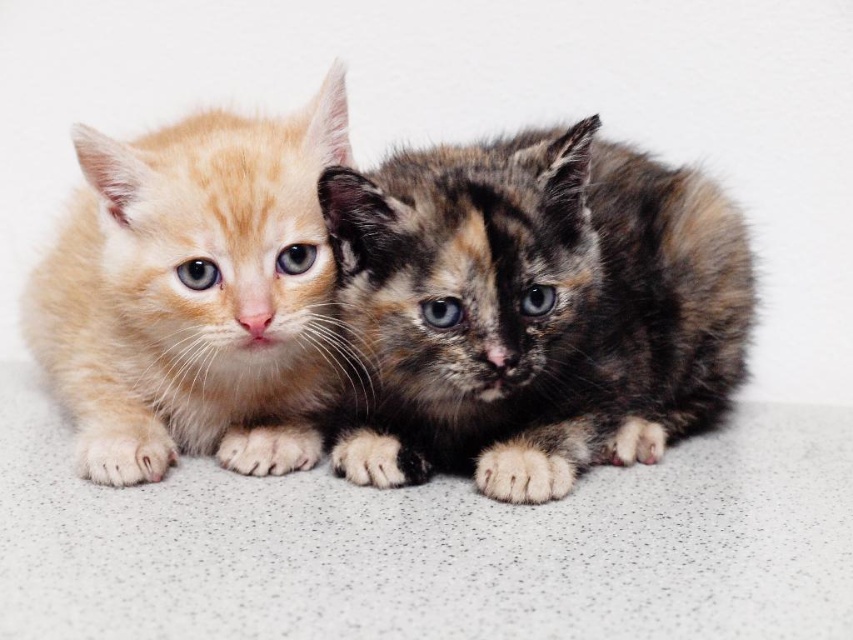
You are a photographer trying to capture both kittens in a single shot. Since the background is white, you want to ensure that the calico fur kitten at center and the matte orange kitten at left are both clearly visible. Based on their positions, which kitten might be easier to see against the white background?

The calico fur kitten at center is in front of the matte orange kitten at left, so the calico fur kitten at center will be easier to see against the white background because it is closer to the camera and not obscured by the other kitten.

You are a cat owner who wants to place both kittens on a shelf that can only hold items up to 30 cm in width. The calico fur kitten at center and the matte orange kitten at left are lying side by side. Can both kittens fit on the shelf if placed together?

The calico fur kitten at center is wider than the matte orange kitten at left. However, without knowing their exact combined width, it is impossible to determine if they can fit on the shelf together.